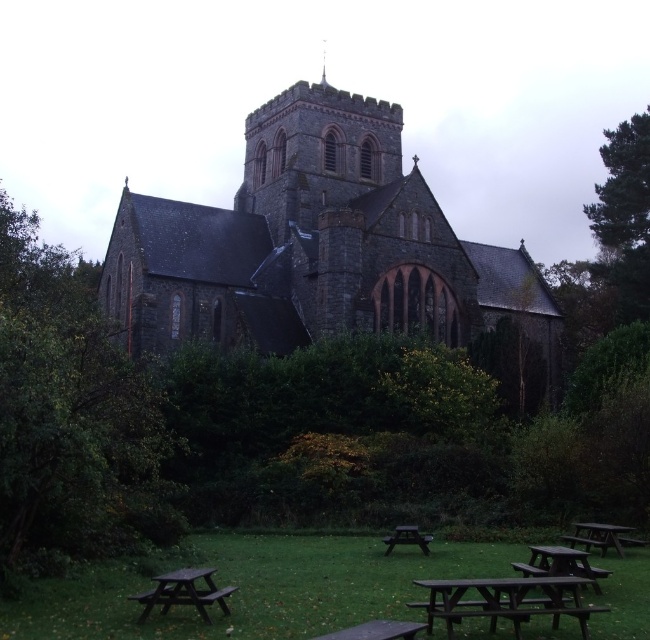
Question: Can you confirm if green grass at lower center is positioned to the right of dark brown wooden table at lower right?

Choices:
 (A) no
 (B) yes

Answer: (A)

Question: Which is nearer to the dark gray stone church at center?

Choices:
 (A) dark brown wooden table at lower right
 (B) green textured tree at right
 (C) green grass at lower center
 (D) dark brown wooden table at lower left

Answer: (B)

Question: Can you confirm if green leafy tree at left is positioned above wooden park bench at lower center?

Choices:
 (A) no
 (B) yes

Answer: (B)

Question: Which point is closer to the camera?

Choices:
 (A) (411, 531)
 (B) (242, 625)

Answer: (B)

Question: Which point is closer to the camera?

Choices:
 (A) wooden park bench at lower center
 (B) wooden picnic table at lower center
 (C) dark gray stone church at center

Answer: (A)

Question: Can you confirm if green leafy tree at left is positioned below wooden picnic table at lower center?

Choices:
 (A) yes
 (B) no

Answer: (B)